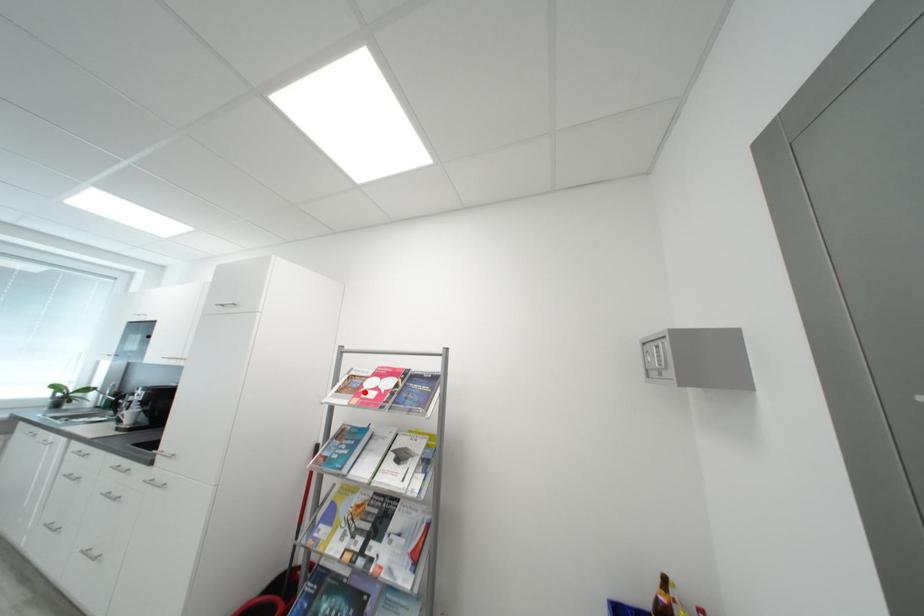
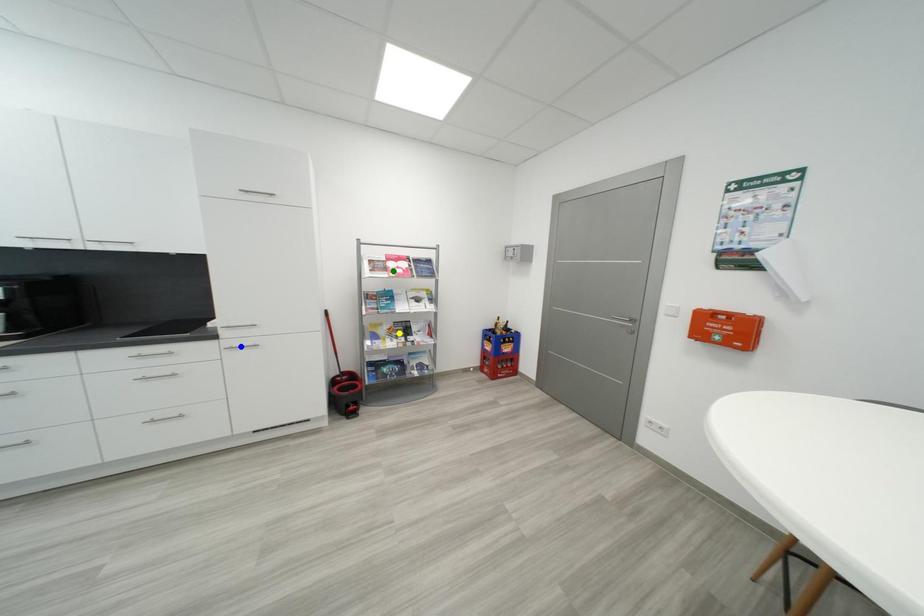
Question: I am providing you with two images of the same scene from different viewpoints. A red point is marked on the first image. You are given multiple points on the second image. Which mark in image 2 goes with the point in image 1?

Choices:
 (A) yellow point
 (B) blue point
 (C) green point

Answer: (C)